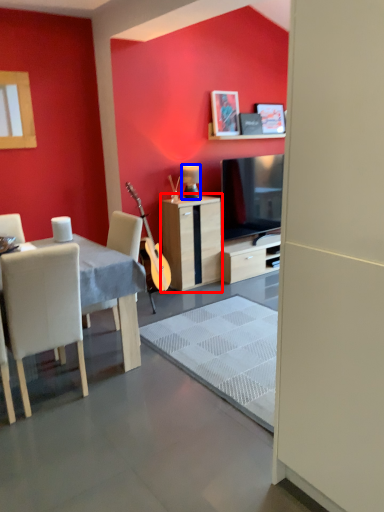
Question: Which of the following is the farthest to the observer, cabinetry (highlighted by a red box) or lamp (highlighted by a blue box)?

Choices:
 (A) cabinetry
 (B) lamp

Answer: (B)